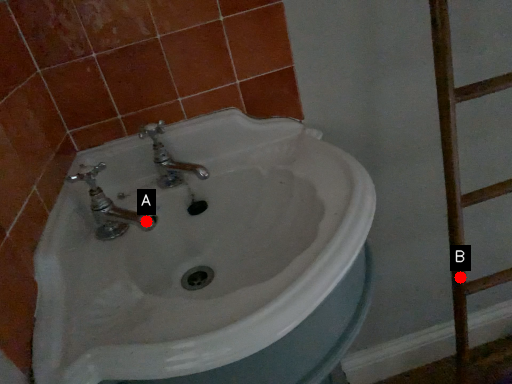
Question: Two points are circled on the image, labeled by A and B beside each circle. Which point is farther from the camera taking this photo?

Choices:
 (A) A is further
 (B) B is further

Answer: (B)